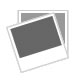
Locate an element on the screen. The height and width of the screenshot is (80, 80). straight picture is located at coordinates (43, 11), (66, 44).